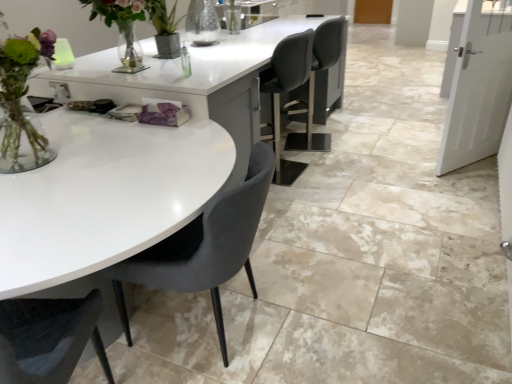
What is the approximate width of white glossy table at center?

It is 9.87 meters.

What do you see at coordinates (126, 161) in the screenshot? I see `white glossy table at center` at bounding box center [126, 161].

Where is `white glossy table at center`? This screenshot has height=384, width=512. white glossy table at center is located at coordinates (126, 161).

What do you see at coordinates (205, 246) in the screenshot?
I see `velvet grey chair at center` at bounding box center [205, 246].

The width and height of the screenshot is (512, 384). Identify the location of velvet grey chair at center. (205, 246).

This screenshot has width=512, height=384. I want to click on white glossy table at center, so click(126, 161).

Does white glossy table at center appear on the right side of velvet grey chair at center?

Correct, you'll find white glossy table at center to the right of velvet grey chair at center.

Does white glossy table at center lie in front of velvet grey chair at center?

Yes, the depth of white glossy table at center is less than that of velvet grey chair at center.

Which point is more distant from viewer, (213,134) or (239,201)?

The point (213,134) is farther.

From the image's perspective, is white glossy table at center beneath velvet grey chair at center?

No, from the image's perspective, white glossy table at center is not beneath velvet grey chair at center.

From a real-world perspective, is white glossy table at center under velvet grey chair at center?

Correct, in the physical world, white glossy table at center is lower than velvet grey chair at center.

Which of these two, white glossy table at center or velvet grey chair at center, is thinner?

velvet grey chair at center.

In the scene shown: Is white glossy table at center taller than velvet grey chair at center?

No.

Who is smaller, white glossy table at center or velvet grey chair at center?

velvet grey chair at center is smaller.

Would you say white glossy table at center contains velvet grey chair at center?

No, velvet grey chair at center is not a part of white glossy table at center.

Consider the image. Is white glossy table at center with velvet grey chair at center?

No, white glossy table at center is not making contact with velvet grey chair at center.

Could you tell me if white glossy table at center is facing velvet grey chair at center?

No.

Based on the photo, what's the angular difference between white glossy table at center and velvet grey chair at center's facing directions?

79.1 degrees separate the facing orientations of white glossy table at center and velvet grey chair at center.

Where is `table above the velvet grey chair at center (from the image's perspective)`? The image size is (512, 384). table above the velvet grey chair at center (from the image's perspective) is located at coordinates (126, 161).

In the image, is velvet grey chair at center on the left side or the right side of white glossy table at center?

Clearly, velvet grey chair at center is on the left of white glossy table at center in the image.

Which object is closer to the camera taking this photo, velvet grey chair at center or white glossy table at center?

white glossy table at center.

Which is behind, point (193, 287) or point (122, 239)?

Point (193, 287)

From the image's perspective, between velvet grey chair at center and white glossy table at center, who is located below?

velvet grey chair at center appears lower in the image.

From a real-world perspective, is velvet grey chair at center physically located above or below white glossy table at center?

velvet grey chair at center is situated higher than white glossy table at center in the real world.

Considering the sizes of objects velvet grey chair at center and white glossy table at center in the image provided, who is thinner, velvet grey chair at center or white glossy table at center?

velvet grey chair at center is thinner.

Who is shorter, velvet grey chair at center or white glossy table at center?

white glossy table at center.

Does velvet grey chair at center have a smaller size compared to white glossy table at center?

Yes, velvet grey chair at center is smaller than white glossy table at center.

Is velvet grey chair at center located outside white glossy table at center?

That's correct, velvet grey chair at center is outside of white glossy table at center.

Is the surface of velvet grey chair at center in direct contact with white glossy table at center?

No, velvet grey chair at center is not next to white glossy table at center.

Is velvet grey chair at center facing towards white glossy table at center?

No, velvet grey chair at center is not turned towards white glossy table at center.

How different are the orientations of velvet grey chair at center and white glossy table at center in degrees?

The angle between the facing direction of velvet grey chair at center and the facing direction of white glossy table at center is 79.1 degrees.

At what (x,y) coordinates should I click in order to perform the action: click on chair located above the white glossy table at center (from a real-world perspective). Please return your answer as a coordinate pair (x, y). Image resolution: width=512 pixels, height=384 pixels. Looking at the image, I should click on (205, 246).

Locate an element on the screen. This screenshot has height=384, width=512. chair below the white glossy table at center (from the image's perspective) is located at coordinates (205, 246).

Find the location of a particular element. Image resolution: width=512 pixels, height=384 pixels. chair that appears behind the white glossy table at center is located at coordinates (205, 246).